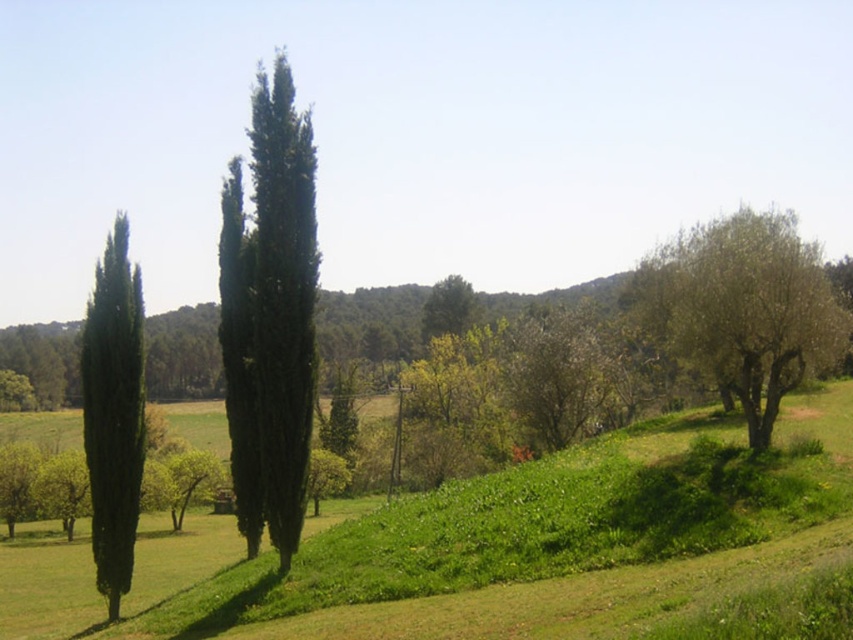
Question: Which object is positioned closest to the green grassy hillside at center?

Choices:
 (A) green textured cypress at center
 (B) green leafy tree at right
 (C) green matte cypress at left

Answer: (A)

Question: Can you confirm if green grassy hillside at center is positioned above green textured cypress at center?

Choices:
 (A) no
 (B) yes

Answer: (A)

Question: Is green textured cypress at center wider than green leafy tree at right?

Choices:
 (A) yes
 (B) no

Answer: (B)

Question: Among these objects, which one is farthest from the camera?

Choices:
 (A) green leafy tree at right
 (B) green grassy hillside at center

Answer: (A)

Question: Is green grassy hillside at center in front of green leafy tree at right?

Choices:
 (A) yes
 (B) no

Answer: (A)

Question: Which object is the closest to the green grassy hillside at center?

Choices:
 (A) green leafy tree at right
 (B) green textured cypress at center

Answer: (B)